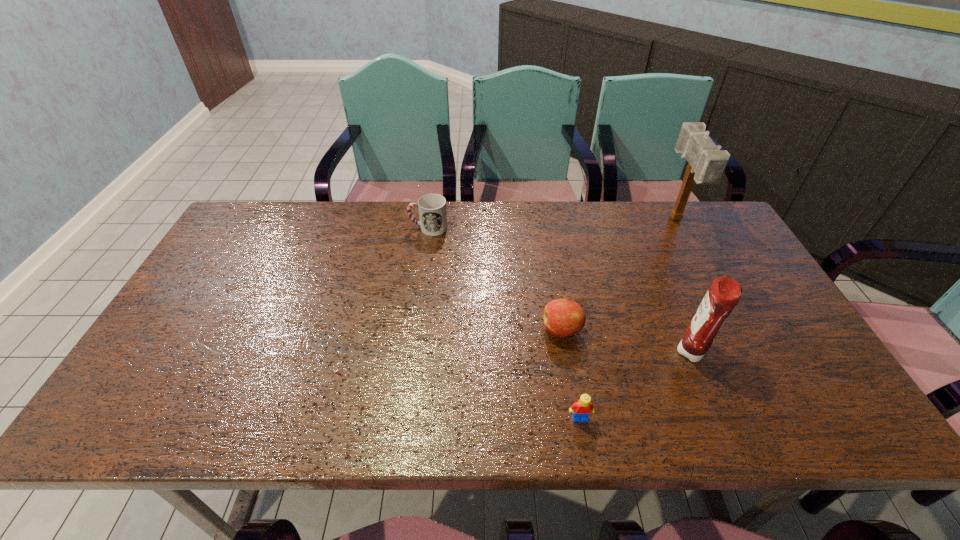
Identify the location of vacant region at the left edge of the desktop. Image resolution: width=960 pixels, height=540 pixels. (195, 388).

At what (x,y) coordinates should I click in order to perform the action: click on vacant space at the far right corner. Please return your answer as a coordinate pair (x, y). Looking at the image, I should click on (702, 239).

Where is `free point between the apple and the tallest object`? Image resolution: width=960 pixels, height=540 pixels. free point between the apple and the tallest object is located at coordinates (619, 275).

Locate an element on the screen. Image resolution: width=960 pixels, height=540 pixels. free point between the second object from right to left and the leftmost object is located at coordinates (561, 291).

Find the location of a particular element. This screenshot has height=540, width=960. vacant area that lies between the fourth object from left to right and the apple is located at coordinates (628, 342).

You are a GUI agent. You are given a task and a screenshot of the screen. Output one action in this format:
    pyautogui.click(x=<x>, y=<y>)
    Task: Click on the vacant region between the nearest object and the rightmost object
    Image resolution: width=960 pixels, height=540 pixels.
    Given the screenshot: What is the action you would take?
    pyautogui.click(x=628, y=319)

Locate an element on the screen. This screenshot has width=960, height=540. free space between the Lego and the tallest object is located at coordinates (628, 319).

At what (x,y) coordinates should I click in order to perform the action: click on vacant point located between the leftmost object and the apple. Please return your answer as a coordinate pair (x, y). Image resolution: width=960 pixels, height=540 pixels. Looking at the image, I should click on (495, 279).

Image resolution: width=960 pixels, height=540 pixels. Find the location of `vacant area that lies between the apple and the condiment`. vacant area that lies between the apple and the condiment is located at coordinates (628, 342).

At what (x,y) coordinates should I click in order to perform the action: click on empty space between the leftmost object and the condiment. Please return your answer as a coordinate pair (x, y). The image size is (960, 540). Looking at the image, I should click on (561, 291).